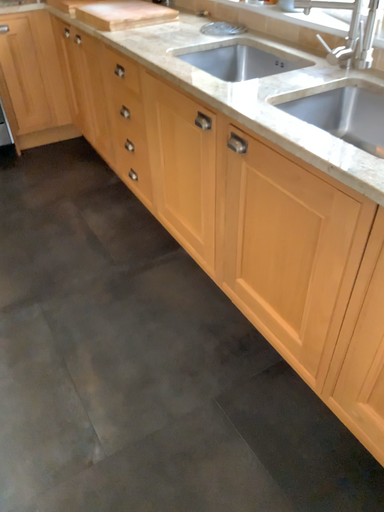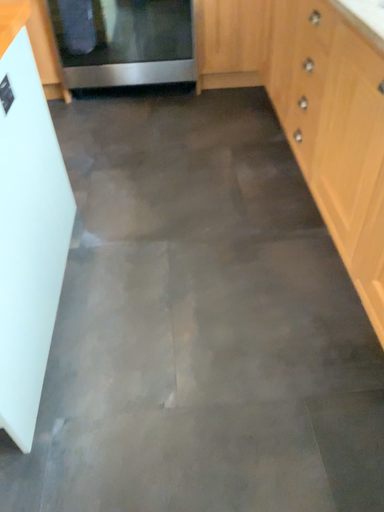
Question: How did the camera likely rotate when shooting the video?

Choices:
 (A) rotated left
 (B) rotated right

Answer: (A)